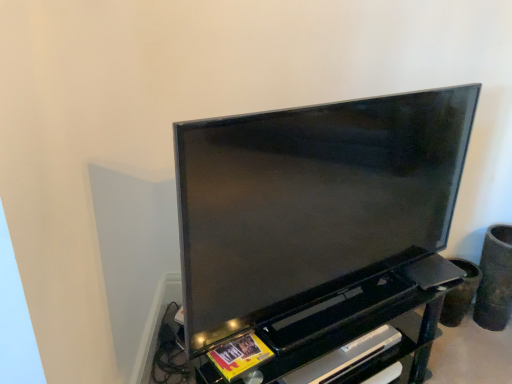
Question: From the image's perspective, is matte black tv at center located beneath black plastic shelf at lower center?

Choices:
 (A) yes
 (B) no

Answer: (B)

Question: Does matte black tv at center have a greater height compared to black plastic shelf at lower center?

Choices:
 (A) no
 (B) yes

Answer: (B)

Question: Considering the relative sizes of matte black tv at center and black plastic shelf at lower center in the image provided, is matte black tv at center smaller than black plastic shelf at lower center?

Choices:
 (A) yes
 (B) no

Answer: (B)

Question: Considering the relative positions of matte black tv at center and black plastic shelf at lower center in the image provided, is matte black tv at center in front of black plastic shelf at lower center?

Choices:
 (A) no
 (B) yes

Answer: (B)

Question: From a real-world perspective, is matte black tv at center positioned over black plastic shelf at lower center based on gravity?

Choices:
 (A) no
 (B) yes

Answer: (B)

Question: Is point (408, 344) closer or farther from the camera than point (415, 350)?

Choices:
 (A) farther
 (B) closer

Answer: (B)

Question: Is black plastic shelf at lower center wider or thinner than black glossy entertainment center at center?

Choices:
 (A) thin
 (B) wide

Answer: (A)

Question: Is black plastic shelf at lower center spatially inside black glossy entertainment center at center, or outside of it?

Choices:
 (A) inside
 (B) outside

Answer: (A)

Question: Considering their positions, is black plastic shelf at lower center located in front of or behind black glossy entertainment center at center?

Choices:
 (A) behind
 (B) front

Answer: (A)

Question: Which is correct: black plastic shelf at lower center is inside matte black tv at center, or outside of it?

Choices:
 (A) outside
 (B) inside

Answer: (A)

Question: Is point (196, 362) positioned closer to the camera than point (269, 264)?

Choices:
 (A) closer
 (B) farther

Answer: (B)

Question: From a real-world perspective, is black plastic shelf at lower center above or below matte black tv at center?

Choices:
 (A) below
 (B) above

Answer: (A)

Question: In terms of width, does black plastic shelf at lower center look wider or thinner when compared to matte black tv at center?

Choices:
 (A) thin
 (B) wide

Answer: (B)

Question: Is matte black tv at center spatially inside black plastic shelf at lower center, or outside of it?

Choices:
 (A) inside
 (B) outside

Answer: (B)

Question: From a real-world perspective, relative to black plastic shelf at lower center, is matte black tv at center vertically above or below?

Choices:
 (A) above
 (B) below

Answer: (A)